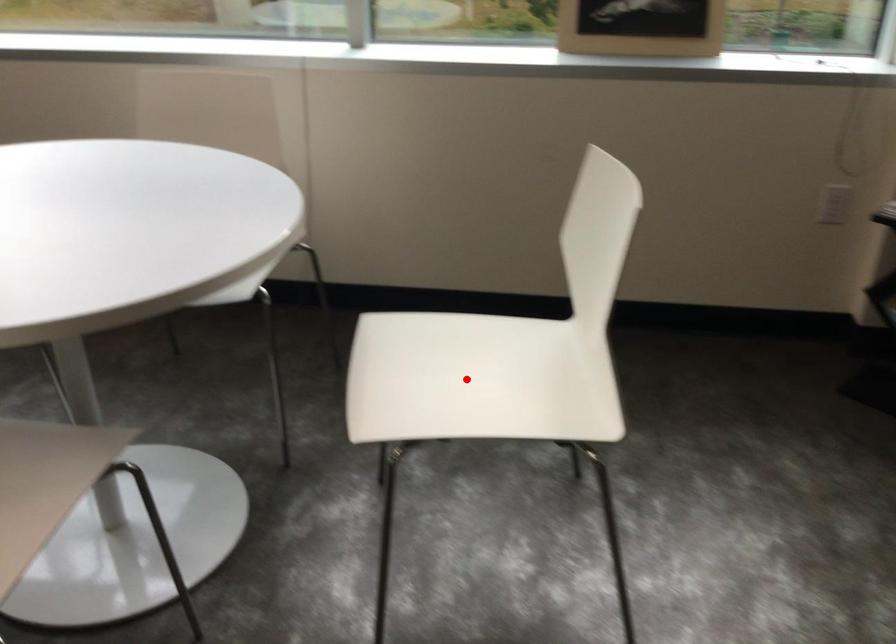
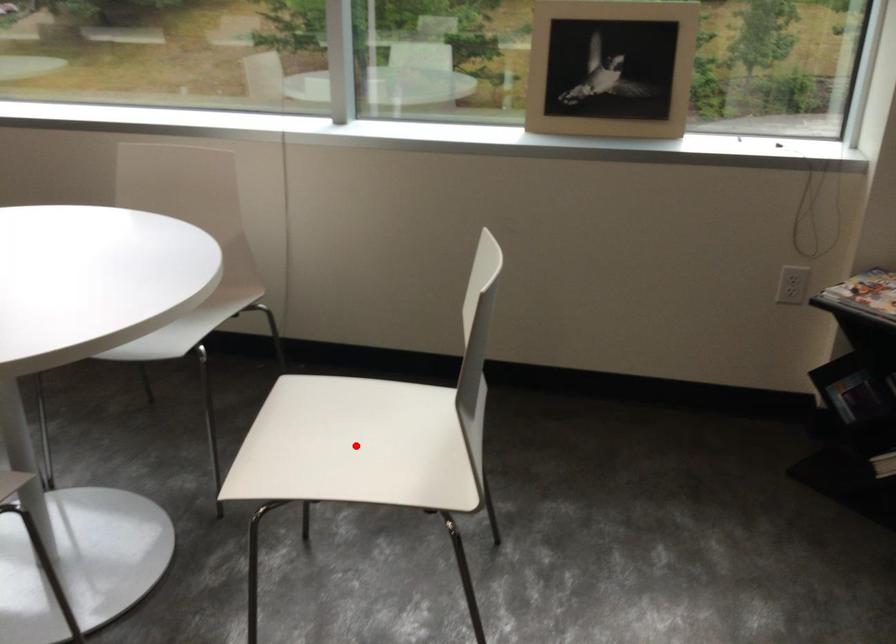
I am providing you with two images of the same scene from different viewpoints. A red point is marked on the first image and another point is marked on the second image. Is the marked point in image1 the same physical position as the marked point in image2?

Yes